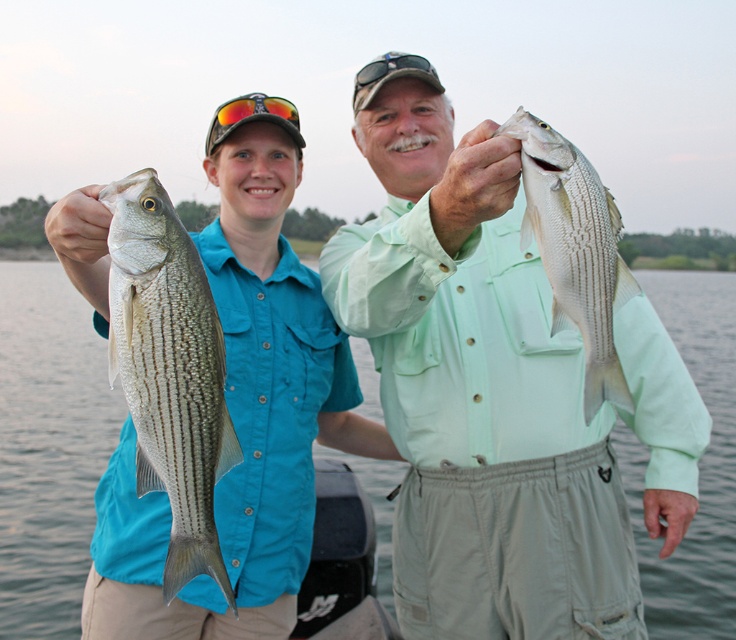
You are an observer on the boat looking at the scene. Which object is located above the other between the clear water at center and the white striped fish at upper center?

The clear water at center is positioned over the white striped fish at upper center, meaning the clear water at center is above the white striped fish at upper center.

You are a marine biologist observing two fish caught by the fishermen. The fish are labeled as the shiny silver fish at left and the white striped fish at upper center. Which fish has a greater length?

The white striped fish at upper center is larger than the shiny silver fish at left, so it has a greater length.

You are a fisherman who just caught two striped bass. You notice the shiny silver fish at left is at coordinate point 0.581, 0.231. Can you confirm if this fish is on the left side of the boat?

The shiny silver fish at left is located at coordinate point (169,371), which confirms it is on the left side of the boat.